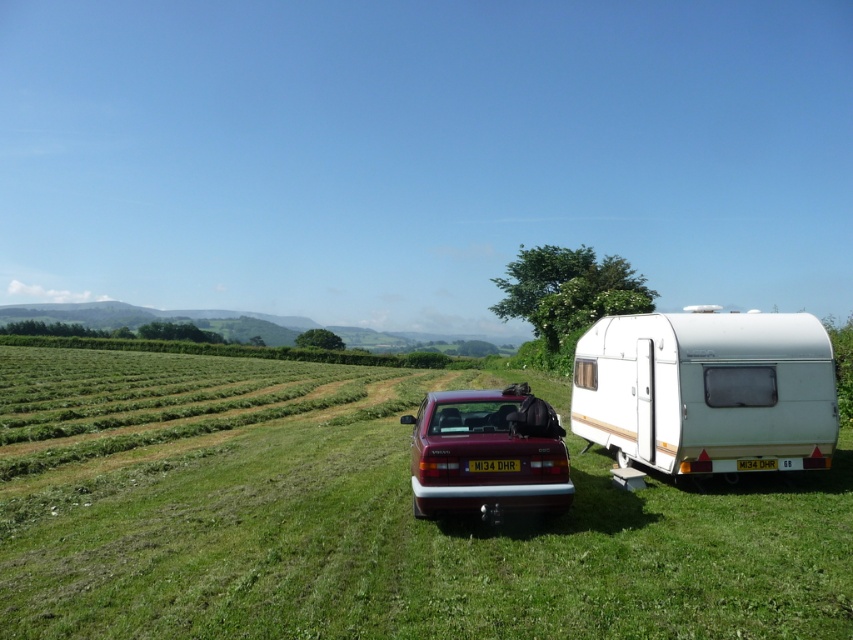
You are a photographer standing in the field and want to take a photo that includes both the white matte caravan at right and the matte red car at center. Which object should you move closer to in order to have both in focus? Explain your reasoning based on their positions.

Since the white matte caravan at right is closer to you than the matte red car at center, you should move closer to the caravan. This way, both objects will be within the depth of field, ensuring they are both in focus in the photo.

You are standing at the center of the field. There is a point marked at coordinates (706, 390). Which object is located at that point?

The point at coordinates (706, 390) corresponds to the white matte caravan at right.